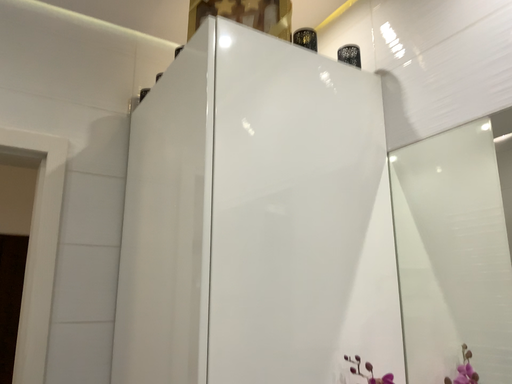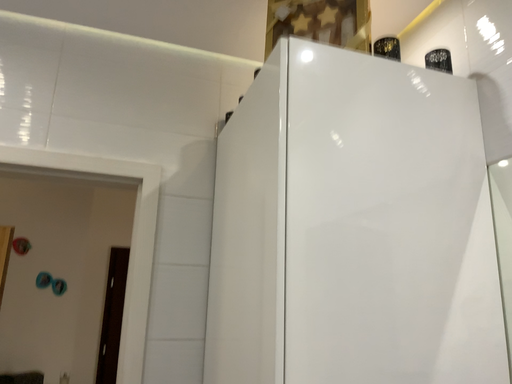
Question: Which way did the camera rotate in the video?

Choices:
 (A) rotated left
 (B) rotated right

Answer: (A)